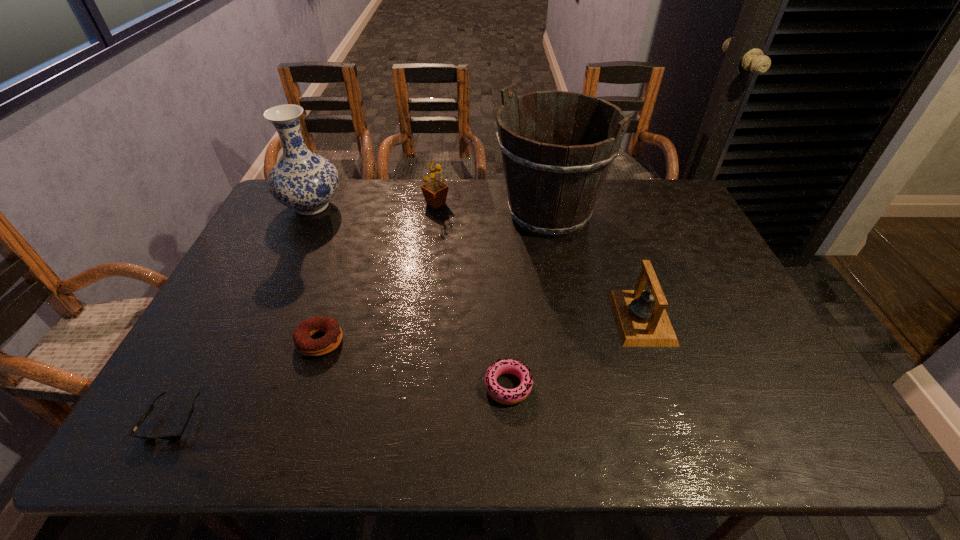
This screenshot has width=960, height=540. I want to click on vase present at the left edge, so click(x=302, y=180).

Image resolution: width=960 pixels, height=540 pixels. I want to click on sunglasses present at the left edge, so click(x=175, y=436).

The width and height of the screenshot is (960, 540). Find the location of `object that is at the far left corner`. object that is at the far left corner is located at coordinates (302, 180).

At what (x,y) coordinates should I click in order to perform the action: click on object that is at the near left corner. Please return your answer as a coordinate pair (x, y). Looking at the image, I should click on (175, 436).

The width and height of the screenshot is (960, 540). I want to click on free space at the far edge, so click(426, 205).

Image resolution: width=960 pixels, height=540 pixels. I want to click on vacant space at the near edge of the desktop, so click(481, 429).

In order to click on vacant space at the left edge of the desktop in this screenshot , I will do `click(235, 301)`.

I want to click on vacant space at the right edge of the desktop, so click(x=654, y=226).

The image size is (960, 540). Find the location of `free space between the bucket and the sunflower`. free space between the bucket and the sunflower is located at coordinates (492, 208).

This screenshot has width=960, height=540. I want to click on blank region between the bell and the shortest object, so click(x=407, y=368).